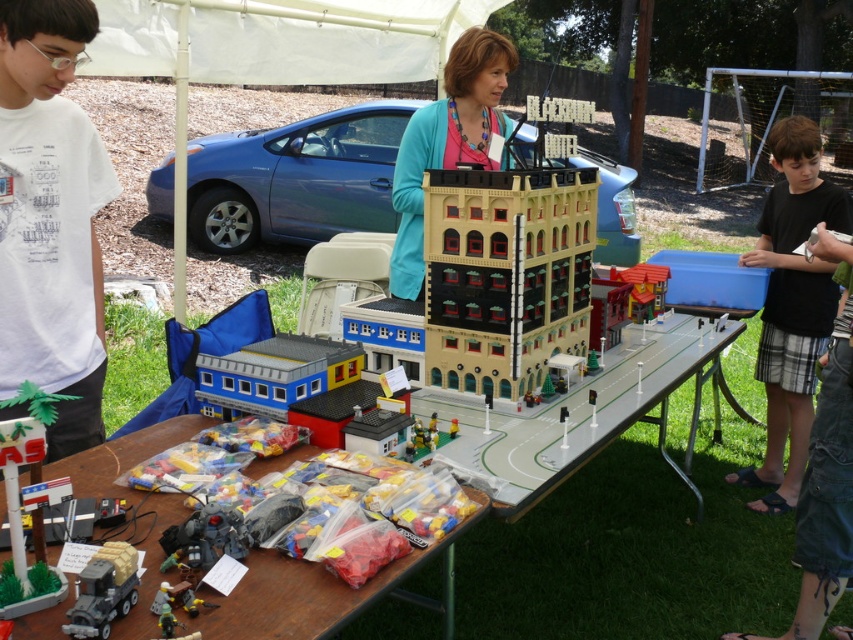
You are a child at the fair looking at the Lego display. You want to pick up the translucent plastic bags at lower center to get some Lego pieces. However, there is a shiny metallic robot at lower left in the way. Can you reach the bags without moving the robot?

The translucent plastic bags at lower center are positioned under the shiny metallic robot at lower left, so you can reach them without moving the robot because they are located beneath it.

You are a photographer standing at the front of the Lego cityscape setup. You want to take a photo that includes both the point at (486, 269) and the point at (633, 291). Which point will appear larger in your photo?

The point at (486, 269) will appear larger in the photo because it is closer to the camera than the point at (633, 291).

You are a visitor at the fair and want to pick up the black plaid shorts at lower right from the ground. Are you able to reach them without moving from your current position near the wooden table at center?

The wooden table at center is closer to the viewer than black plaid shorts at lower right, so you are able to reach them without moving from your current position near the wooden table at center.